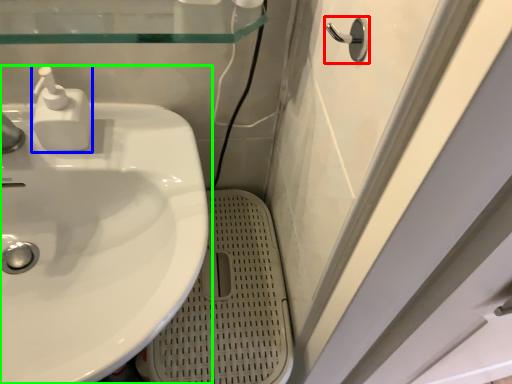
Question: Considering the real-world distances, which object is farthest from door handle (highlighted by a red box)? soap dispenser (highlighted by a blue box) or sink (highlighted by a green box)?

Choices:
 (A) soap dispenser
 (B) sink

Answer: (B)